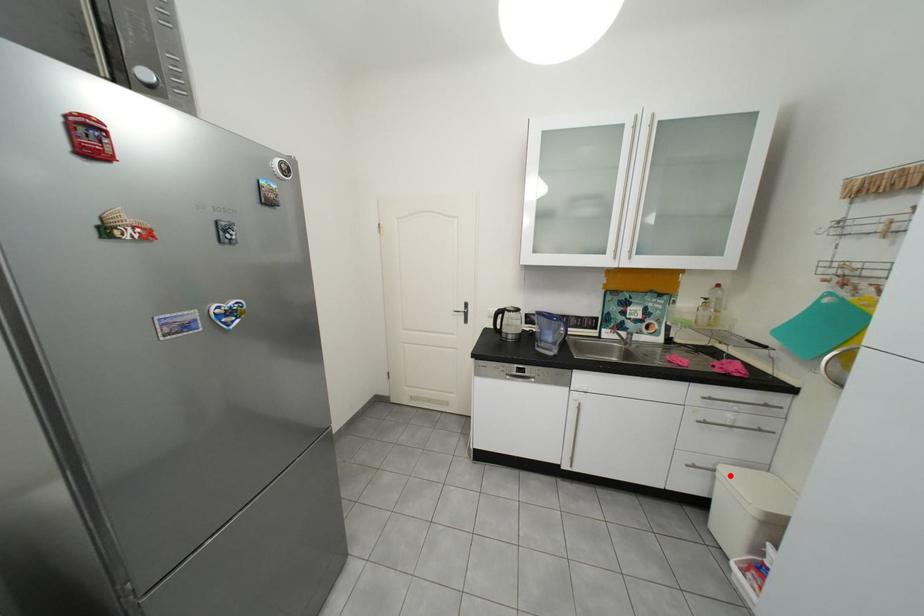
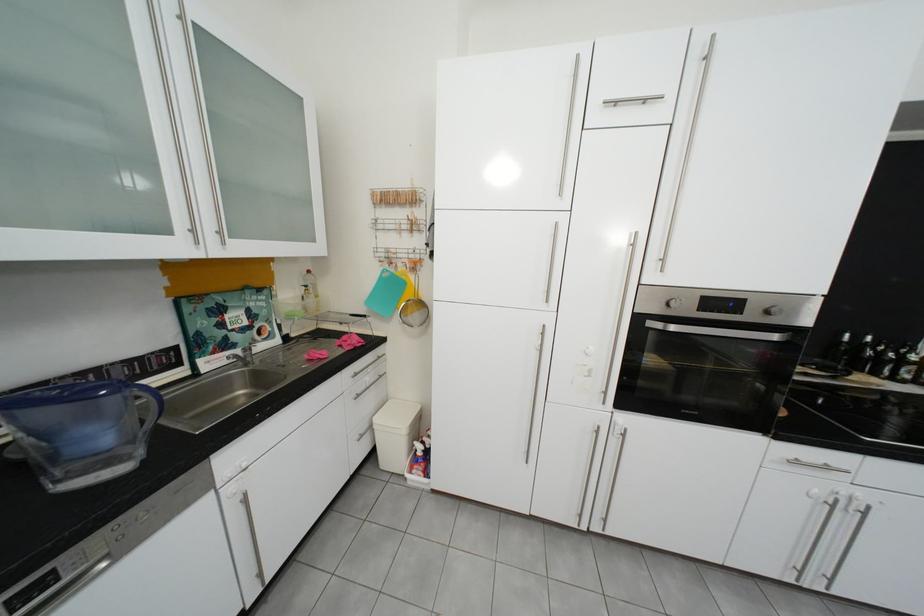
Where in the second image is the point corresponding to the highlighted location from the first image?

(386, 428)